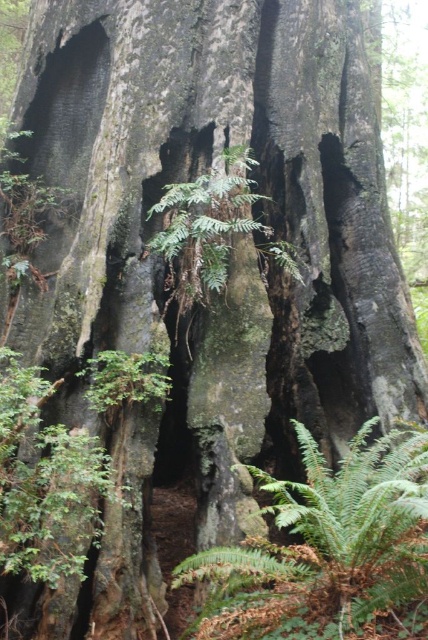
Question: Is green rough fern at lower left below green rough textured fern at center?

Choices:
 (A) no
 (B) yes

Answer: (B)

Question: Which point is closer to the camera?

Choices:
 (A) green fuzzy fern at center
 (B) green rough textured fern at center

Answer: (A)

Question: Which of the following is the closest to the observer?

Choices:
 (A) green fuzzy fern at center
 (B) green rough fern at lower left

Answer: (A)

Question: Is green fuzzy fern at center to the left of green rough textured fern at center from the viewer's perspective?

Choices:
 (A) yes
 (B) no

Answer: (B)

Question: Is green fuzzy fern at center bigger than green rough fern at lower left?

Choices:
 (A) no
 (B) yes

Answer: (B)

Question: Which of the following is the farthest from the observer?

Choices:
 (A) green rough fern at lower left
 (B) green fuzzy fern at center
 (C) green rough textured fern at center

Answer: (C)